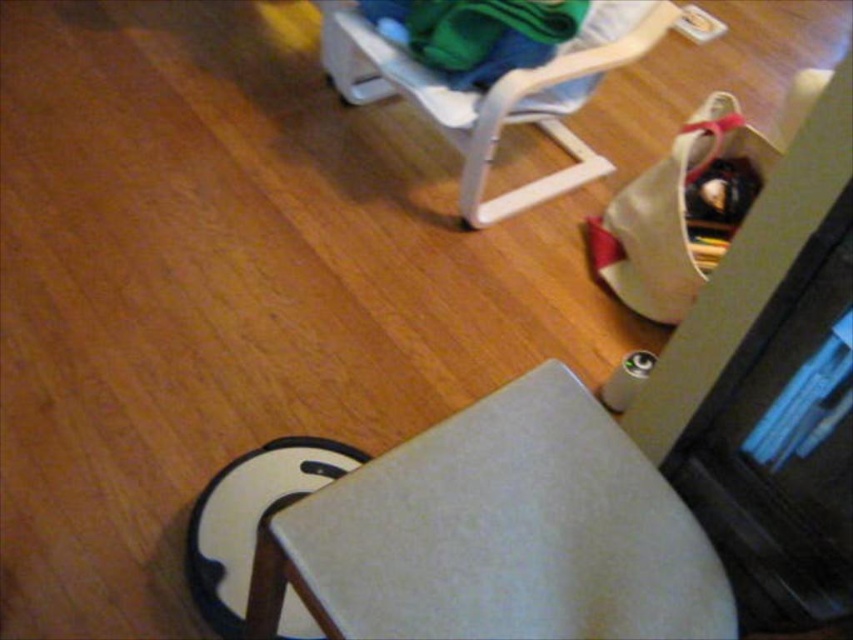
You are standing in the room depicted in the scene. There is a point at coordinates (498, 532). What object is located at this point?

The point at coordinates (498, 532) corresponds to the matte gray cushion at lower center.

You are trying to sit down in the room shown. You see a matte gray cushion at lower center and a white plastic folding chair at upper center. Which one is more likely to provide a comfortable seating option based on their thickness?

The white plastic folding chair at upper center is thicker than the matte gray cushion at lower center, so it is more likely to provide a comfortable seating option.